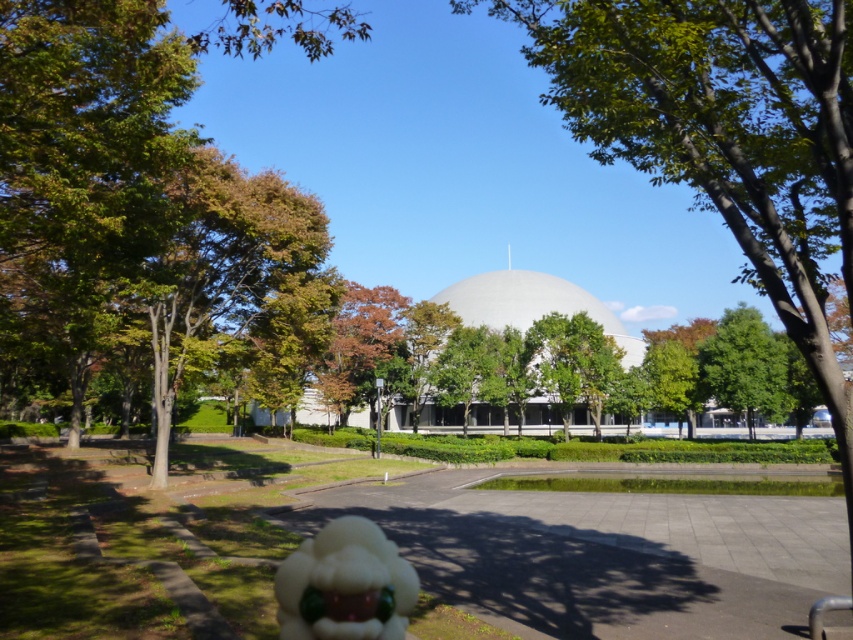
Is white smooth dome at center wider than green leafy tree at right?

Yes, white smooth dome at center is wider than green leafy tree at right.

Who is more forward, (570, 298) or (753, 392)?

Point (753, 392) is more forward.

Locate an element on the screen. Image resolution: width=853 pixels, height=640 pixels. white smooth dome at center is located at coordinates (531, 305).

Is white fluffy toy at lower center below green leafy tree at right?

No, white fluffy toy at lower center is not below green leafy tree at right.

Is white fluffy toy at lower center wider than green leafy tree at right?

No.

Is point (292, 621) behind point (761, 353)?

No.

Image resolution: width=853 pixels, height=640 pixels. I want to click on white fluffy toy at lower center, so click(x=345, y=586).

Is white fluffy toy at lower center to the right of white smooth dome at center from the viewer's perspective?

In fact, white fluffy toy at lower center is to the left of white smooth dome at center.

Is white fluffy toy at lower center bigger than white smooth dome at center?

Actually, white fluffy toy at lower center might be smaller than white smooth dome at center.

I want to click on white fluffy toy at lower center, so pos(345,586).